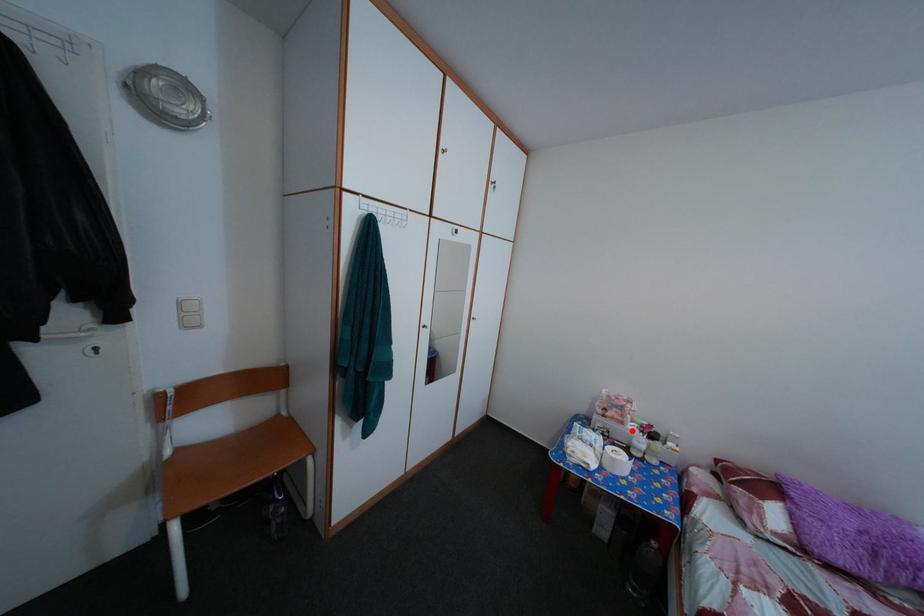
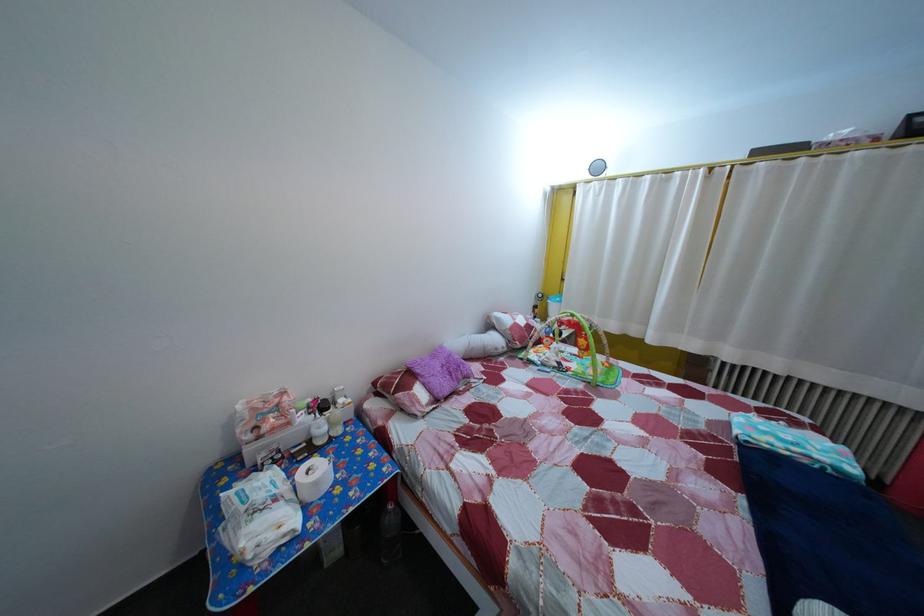
In the second image, find the point that corresponds to the highlighted location in the first image.

(298, 432)